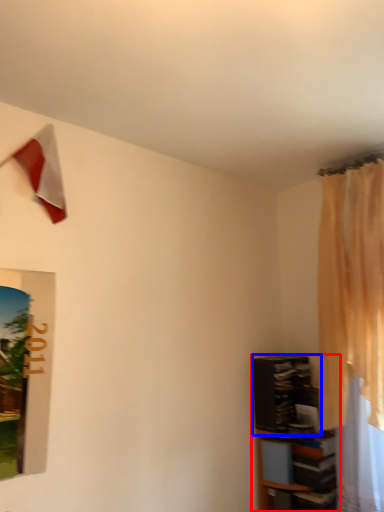
Question: Which of the following is the farthest to the observer, shelf (highlighted by a red box) or shelf (highlighted by a blue box)?

Choices:
 (A) shelf
 (B) shelf

Answer: (B)